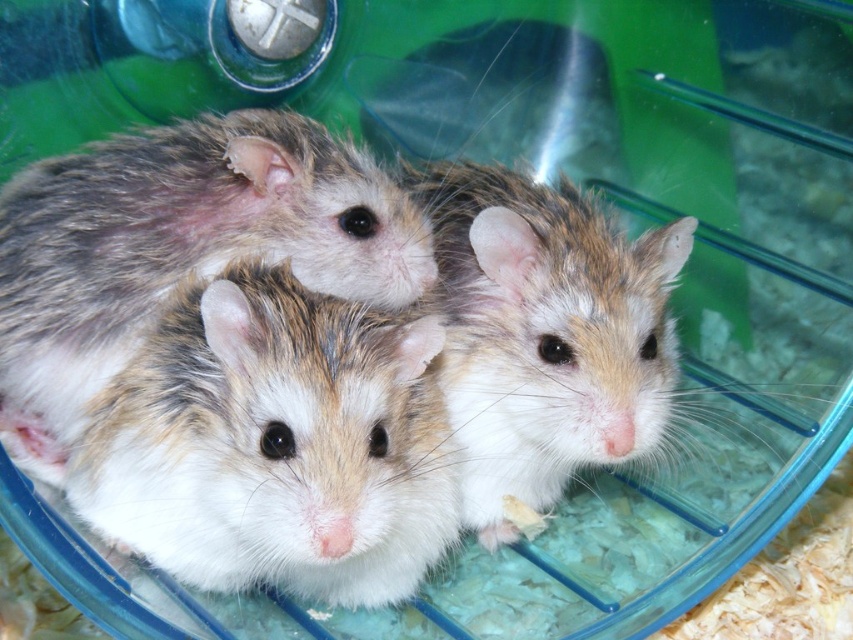
Question: Does fluffy white hamster at center have a lesser width compared to fuzzy brown hamster at center?

Choices:
 (A) no
 (B) yes

Answer: (A)

Question: Which object appears closest to the camera in this image?

Choices:
 (A) fuzzy brown hamster at center
 (B) fluffy white hamster at center
 (C) fluffy white mouse at center

Answer: (C)

Question: Which point is farther to the camera?

Choices:
 (A) (213, 221)
 (B) (505, 244)

Answer: (B)

Question: Can you confirm if fluffy white mouse at center is smaller than fuzzy brown hamster at center?

Choices:
 (A) yes
 (B) no

Answer: (B)

Question: In this image, where is fluffy white hamster at center located relative to fuzzy brown hamster at center?

Choices:
 (A) above
 (B) below

Answer: (A)

Question: Estimate the real-world distances between objects in this image. Which object is farther from the fuzzy brown hamster at center?

Choices:
 (A) fluffy white mouse at center
 (B) fluffy white hamster at center

Answer: (B)